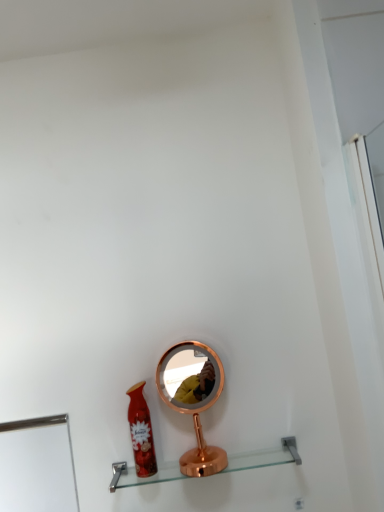
Question: Should I look upward or downward to see clear glass shelf at center?

Choices:
 (A) up
 (B) down

Answer: (B)

Question: Would you say matte red spray can at lower center is part of clear glass shelf at center's contents?

Choices:
 (A) yes
 (B) no

Answer: (B)

Question: Does clear glass shelf at center touch matte red spray can at lower center?

Choices:
 (A) no
 (B) yes

Answer: (A)

Question: From a real-world perspective, is clear glass shelf at center physically above matte red spray can at lower center?

Choices:
 (A) yes
 (B) no

Answer: (B)

Question: Is clear glass shelf at center oriented away from matte red spray can at lower center?

Choices:
 (A) yes
 (B) no

Answer: (B)

Question: From the image's perspective, would you say clear glass shelf at center is shown under matte red spray can at lower center?

Choices:
 (A) no
 (B) yes

Answer: (B)

Question: Is clear glass shelf at center facing towards matte red spray can at lower center?

Choices:
 (A) no
 (B) yes

Answer: (A)

Question: Could you tell me if matte red spray can at lower center is facing clear glass shelf at center?

Choices:
 (A) yes
 (B) no

Answer: (B)

Question: Can you confirm if matte red spray can at lower center is positioned to the right of clear glass shelf at center?

Choices:
 (A) no
 (B) yes

Answer: (A)

Question: From a real-world perspective, is matte red spray can at lower center on clear glass shelf at center?

Choices:
 (A) yes
 (B) no

Answer: (A)

Question: Is matte red spray can at lower center at the left side of clear glass shelf at center?

Choices:
 (A) yes
 (B) no

Answer: (A)

Question: Can clear glass shelf at center be found inside matte red spray can at lower center?

Choices:
 (A) no
 (B) yes

Answer: (A)

Question: Can you confirm if matte red spray can at lower center is shorter than clear glass shelf at center?

Choices:
 (A) yes
 (B) no

Answer: (B)

Question: Is matte red spray can at lower center not inside copper metallic mirror at center?

Choices:
 (A) no
 (B) yes

Answer: (B)